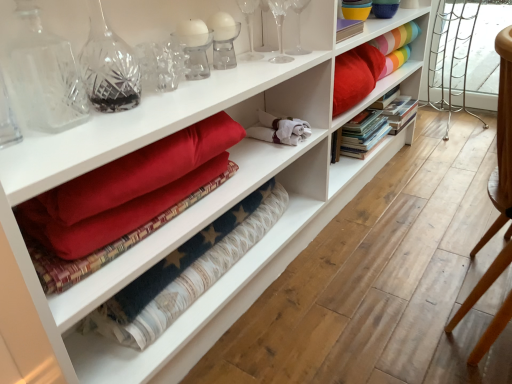
Locate an element on the screen. The image size is (512, 384). free space underneath wooden chair at right (from a real-world perspective) is located at coordinates (463, 298).